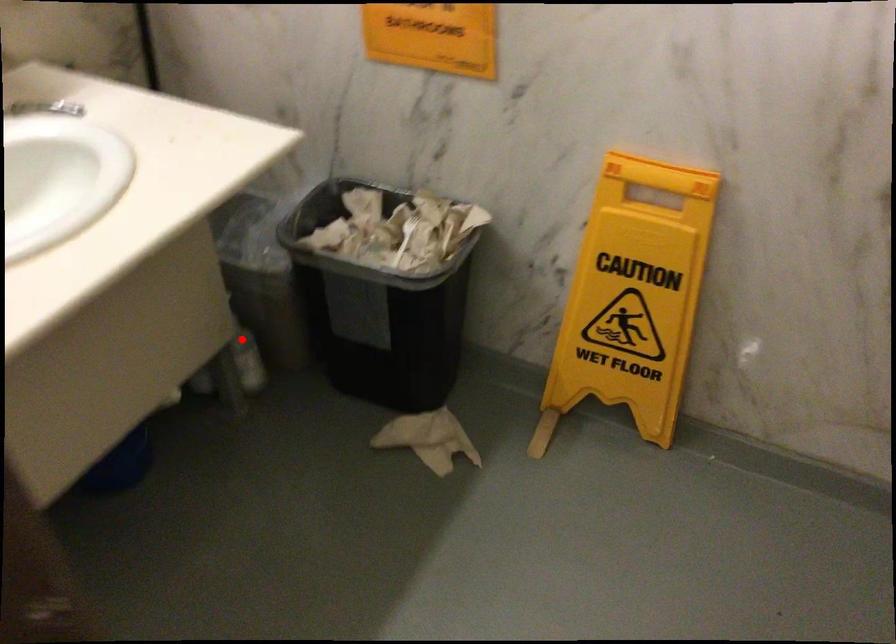
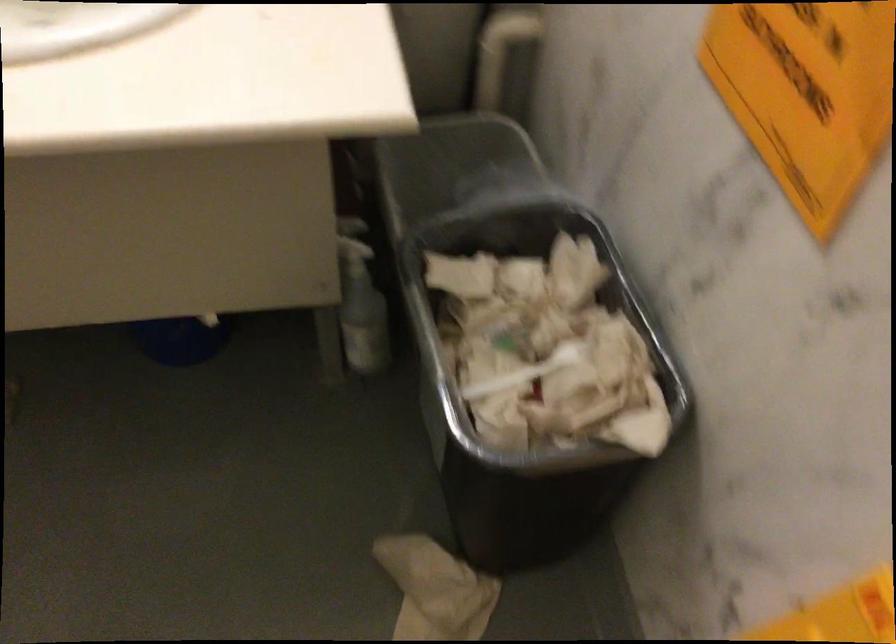
Question: I am providing you with two images of the same scene from different viewpoints. Image1 has a red point marked. In image2, the corresponding 3D location appears at what relative position? Reply with the corresponding letter.

Choices:
 (A) Closer
 (B) Farther

Answer: (A)